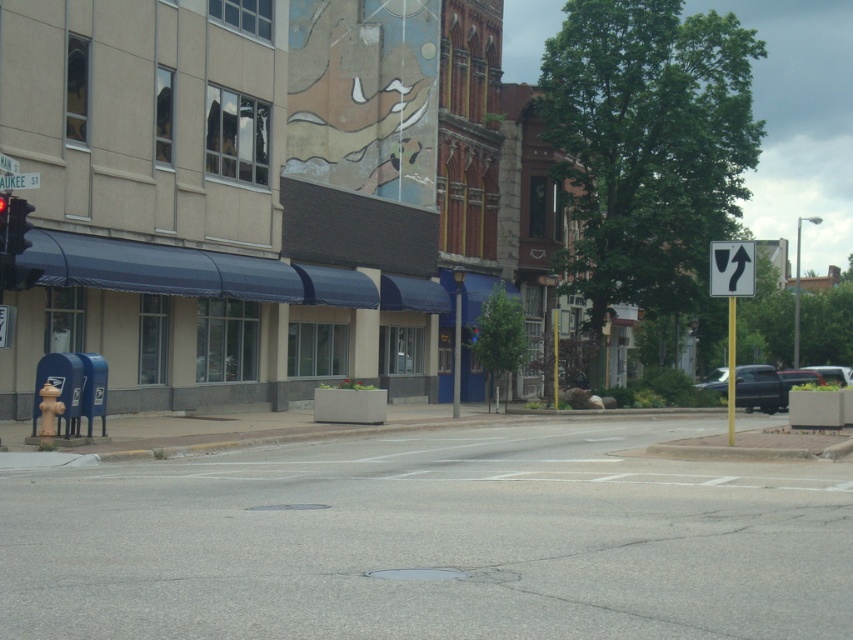
Where is `yellow reflective plastic arrow at upper right`? The image size is (853, 640). yellow reflective plastic arrow at upper right is located at coordinates pos(730,268).

Does point (741, 269) lie in front of point (830, 380)?

Yes, it is in front of point (830, 380).

Measure the distance between point [751,289] and camera.

Point [751,289] and camera are 18.48 meters apart from each other.

I want to click on yellow reflective plastic arrow at upper right, so click(x=730, y=268).

Does gray asphalt at center have a larger size compared to red glass traffic light at left?

Yes, gray asphalt at center is bigger than red glass traffic light at left.

Who is lower down, gray asphalt at center or red glass traffic light at left?

gray asphalt at center is below.

The image size is (853, 640). What do you see at coordinates (432, 540) in the screenshot?
I see `gray asphalt at center` at bounding box center [432, 540].

You are a GUI agent. You are given a task and a screenshot of the screen. Output one action in this format:
    pyautogui.click(x=<x>, y=<y>)
    Task: Click on the gray asphalt at center
    The height and width of the screenshot is (640, 853).
    Given the screenshot: What is the action you would take?
    pyautogui.click(x=432, y=540)

From the picture: Which of these two, metallic silver car at right or red glass traffic light at left, stands taller?

metallic silver car at right

Does point (793, 372) lie behind point (4, 243)?

That is True.

Between point (787, 392) and point (9, 204), which one is positioned behind?

Positioned behind is point (787, 392).

This screenshot has width=853, height=640. Identify the location of metallic silver car at right. (796, 381).